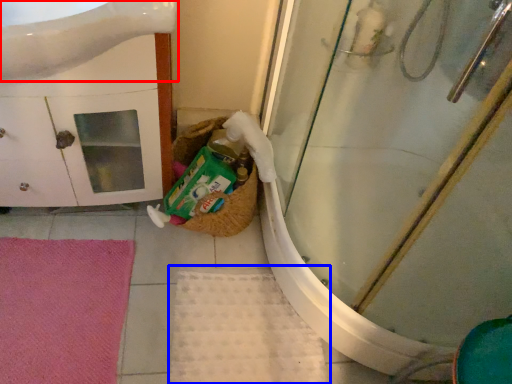
Question: Which object is closer to the camera taking this photo, sink (highlighted by a red box) or bath mat (highlighted by a blue box)?

Choices:
 (A) sink
 (B) bath mat

Answer: (A)